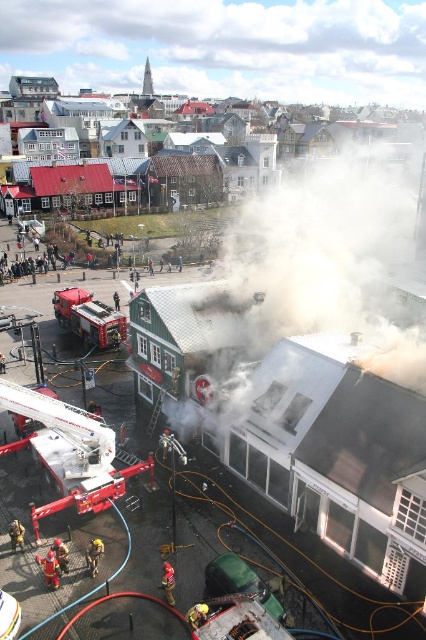
You are a firefighter needing to reach the fireman at the scene. You see the red metallic fire truck at lower left and the red uniform fireman at lower left. Which object is closer to you?

The red uniform fireman at lower left is closer to you because the red metallic fire truck at lower left is further away from the viewer.